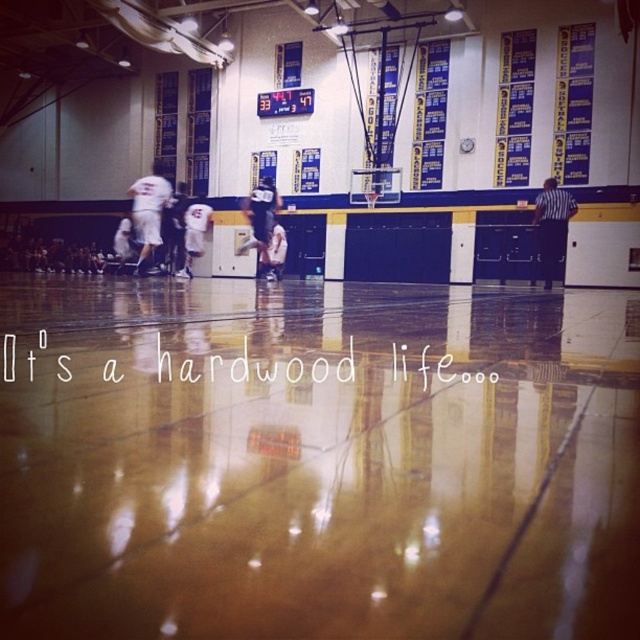
Question: Which point is farther to the camera?

Choices:
 (A) black striped shirt at right
 (B) white jersey basketball players at center
 (C) white jersey at left
 (D) white jersey at center

Answer: (D)

Question: Is black striped shirt at right to the left of white jersey at center from the viewer's perspective?

Choices:
 (A) yes
 (B) no

Answer: (B)

Question: Can you confirm if white jersey basketball players at center is positioned below black striped shirt at right?

Choices:
 (A) no
 (B) yes

Answer: (A)

Question: Which point is closer to the camera?

Choices:
 (A) (196, 234)
 (B) (138, 230)
 (C) (552, 244)
 (D) (273, 189)

Answer: (B)

Question: Which object appears closest to the camera in this image?

Choices:
 (A) black striped shirt at right
 (B) white jersey at center
 (C) white jersey basketball players at center

Answer: (C)

Question: Can you confirm if white jersey at left is thinner than black striped shirt at right?

Choices:
 (A) yes
 (B) no

Answer: (B)